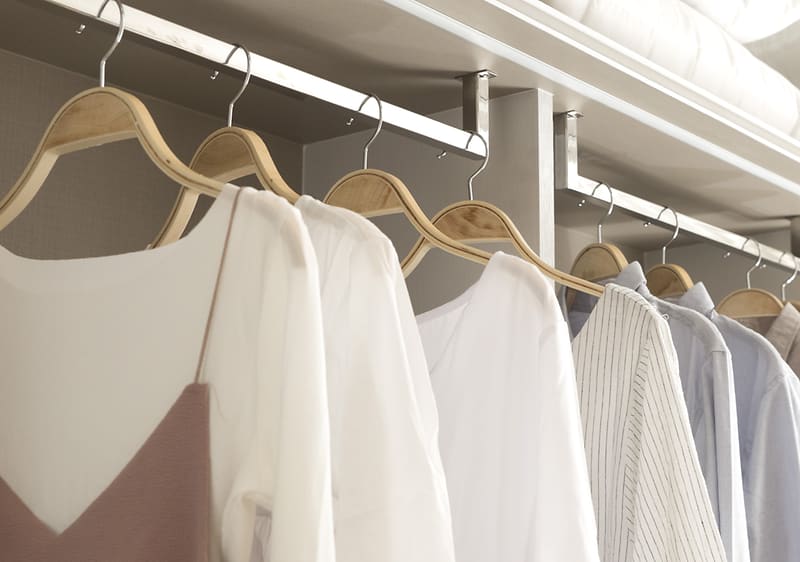
Identify the location of chrome hanger hook. The width and height of the screenshot is (800, 562). (102, 60), (232, 102), (366, 147), (470, 178), (598, 222), (665, 244), (749, 271), (785, 283).